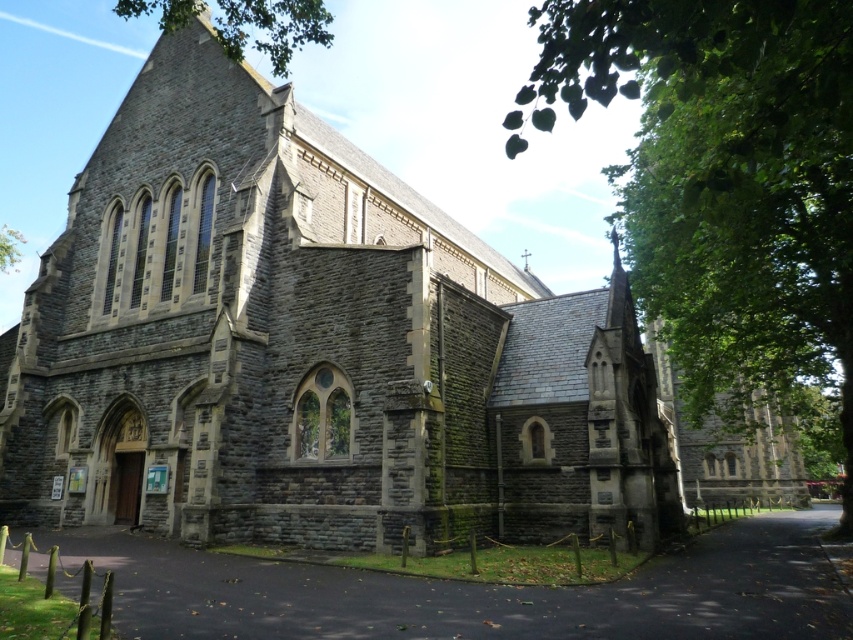
Question: Does gray stone church at center have a smaller size compared to green leafy tree at upper left?

Choices:
 (A) yes
 (B) no

Answer: (B)

Question: Estimate the real-world distances between objects in this image. Which object is closer to the green leafy tree at upper left?

Choices:
 (A) gray stone church at center
 (B) green leafy tree at right

Answer: (A)

Question: Among these points, which one is nearest to the camera?

Choices:
 (A) (0, 246)
 (B) (225, 216)

Answer: (B)

Question: Can you confirm if gray stone church at center is positioned above green leafy tree at upper left?

Choices:
 (A) no
 (B) yes

Answer: (A)

Question: Is green leafy tree at right below green leafy tree at upper left?

Choices:
 (A) no
 (B) yes

Answer: (A)

Question: Which is farther from the green leafy tree at right?

Choices:
 (A) green leafy tree at upper left
 (B) gray stone church at center

Answer: (A)